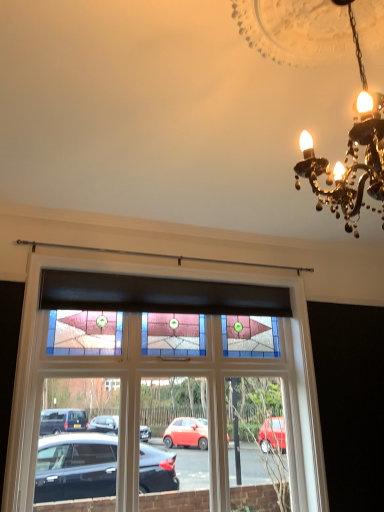
Measure the distance between point (303, 355) and camera.

The distance of point (303, 355) from camera is 12.14 feet.

This screenshot has height=512, width=384. In order to click on stained glass window at center in this screenshot , I will do [x=168, y=374].

The width and height of the screenshot is (384, 512). What do you see at coordinates (168, 374) in the screenshot?
I see `stained glass window at center` at bounding box center [168, 374].

This screenshot has width=384, height=512. I want to click on stained glass window at center, so click(x=168, y=374).